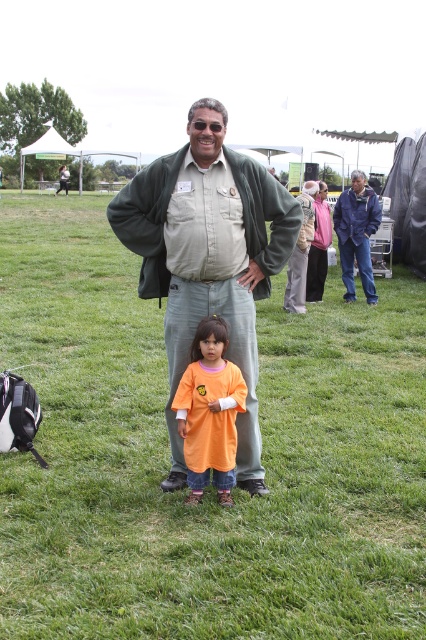
Question: Can you confirm if matte khaki shirt at center is positioned to the left of blue denim jacket at center?

Choices:
 (A) yes
 (B) no

Answer: (A)

Question: Is matte khaki shirt at center wider than orange cotton shirt at center?

Choices:
 (A) yes
 (B) no

Answer: (A)

Question: Considering the real-world distances, which object is closest to the orange cotton shirt at center?

Choices:
 (A) matte khaki shirt at center
 (B) green grass at center
 (C) blue denim jacket at center

Answer: (A)

Question: Which point appears closest to the camera in this image?

Choices:
 (A) click(371, 304)
 (B) click(245, 353)

Answer: (B)

Question: Which object is closer to the camera taking this photo?

Choices:
 (A) green grass at center
 (B) blue denim jacket at center
 (C) orange cotton shirt at center

Answer: (A)

Question: Can you confirm if green grass at center is bigger than blue denim jacket at center?

Choices:
 (A) yes
 (B) no

Answer: (A)